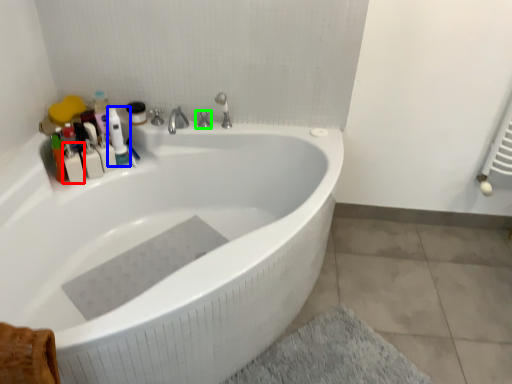
Question: Estimate the real-world distances between objects in this image. Which object is closer to toiletry (highlighted by a red box), cleaning product (highlighted by a blue box) or tap (highlighted by a green box)?

Choices:
 (A) cleaning product
 (B) tap

Answer: (A)